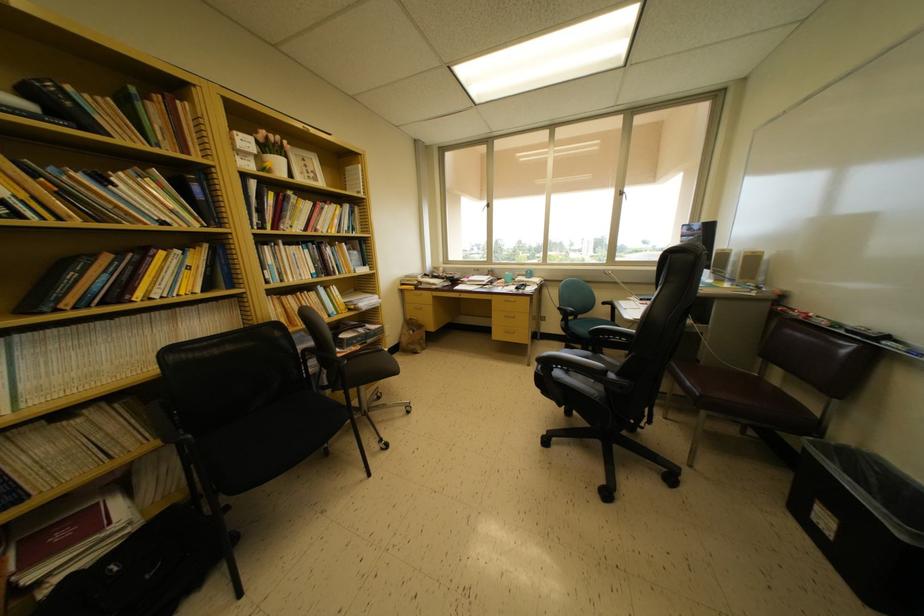
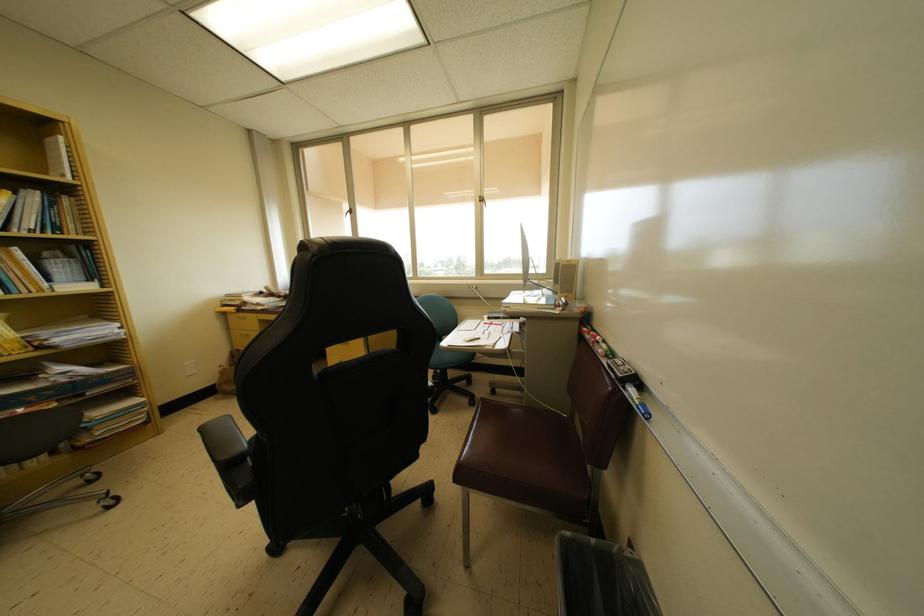
Find the pixel in the second image that matches (x=342, y=217) in the first image.

(7, 206)